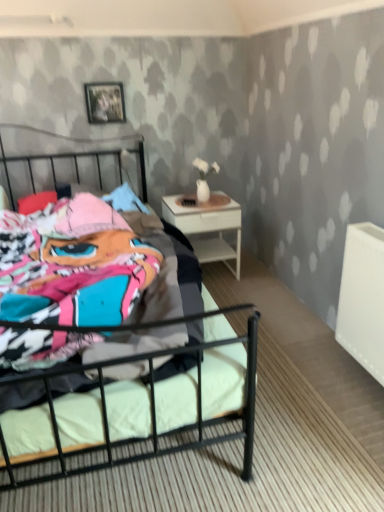
Question: Considering the relative sizes of white glossy nightstand at right and metallic black bed at center in the image provided, is white glossy nightstand at right wider than metallic black bed at center?

Choices:
 (A) yes
 (B) no

Answer: (B)

Question: Is white glossy nightstand at right far away from metallic black bed at center?

Choices:
 (A) yes
 (B) no

Answer: (B)

Question: Could you tell me if white glossy nightstand at right is facing metallic black bed at center?

Choices:
 (A) yes
 (B) no

Answer: (B)

Question: From a real-world perspective, is white glossy nightstand at right positioned under metallic black bed at center based on gravity?

Choices:
 (A) yes
 (B) no

Answer: (A)

Question: From a real-world perspective, is white glossy nightstand at right on top of metallic black bed at center?

Choices:
 (A) yes
 (B) no

Answer: (B)

Question: In the image, is white glossy nightstand at right positioned in front of or behind metallic silver picture frame at upper center?

Choices:
 (A) front
 (B) behind

Answer: (A)

Question: From the image's perspective, is white glossy nightstand at right positioned above or below metallic silver picture frame at upper center?

Choices:
 (A) above
 (B) below

Answer: (B)

Question: In terms of width, does white glossy nightstand at right look wider or thinner when compared to metallic silver picture frame at upper center?

Choices:
 (A) thin
 (B) wide

Answer: (B)

Question: Considering the positions of white glossy nightstand at right and metallic silver picture frame at upper center in the image, is white glossy nightstand at right taller or shorter than metallic silver picture frame at upper center?

Choices:
 (A) tall
 (B) short

Answer: (A)

Question: From the image's perspective, is metallic silver picture frame at upper center above or below white glossy nightstand at right?

Choices:
 (A) below
 (B) above

Answer: (B)

Question: Based on their sizes in the image, would you say metallic silver picture frame at upper center is bigger or smaller than white glossy nightstand at right?

Choices:
 (A) big
 (B) small

Answer: (B)

Question: From a real-world perspective, is metallic silver picture frame at upper center positioned above or below white glossy nightstand at right?

Choices:
 (A) above
 (B) below

Answer: (A)

Question: Do you think metallic silver picture frame at upper center is within white glossy nightstand at right, or outside of it?

Choices:
 (A) outside
 (B) inside

Answer: (A)

Question: In terms of height, does metallic black bed at center look taller or shorter compared to white glossy nightstand at right?

Choices:
 (A) tall
 (B) short

Answer: (A)

Question: Is metallic black bed at center situated inside white glossy nightstand at right or outside?

Choices:
 (A) inside
 (B) outside

Answer: (B)